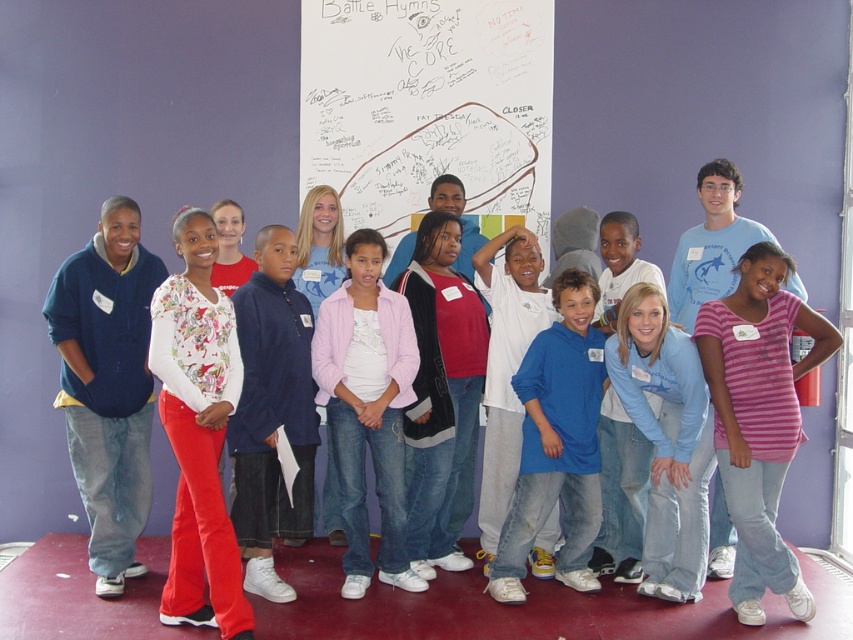
Question: Which object is the closest to the whiteboard at center?

Choices:
 (A) blue fleece jacket at center
 (B) pink striped shirt at center
 (C) pink cotton jacket at center

Answer: (C)

Question: Which point appears farthest from the camera in this image?

Choices:
 (A) (577, 404)
 (B) (300, 176)
 (C) (358, 566)
 (D) (758, 584)

Answer: (B)

Question: Can you confirm if pink striped shirt at center is bigger than floral print blouse at center?

Choices:
 (A) yes
 (B) no

Answer: (B)

Question: Which of the following is the closest to the observer?

Choices:
 (A) whiteboard at center
 (B) blue fleece jacket at center
 (C) pink cotton jacket at center

Answer: (B)

Question: Does whiteboard at center appear over pink striped shirt at center?

Choices:
 (A) yes
 (B) no

Answer: (A)

Question: Can you confirm if whiteboard at center is positioned below floral print blouse at center?

Choices:
 (A) no
 (B) yes

Answer: (A)